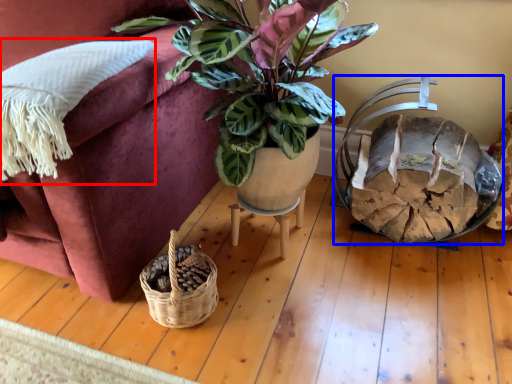
Question: Among these objects, which one is nearest to the camera, pillow (highlighted by a red box) or swivel chair (highlighted by a blue box)?

Choices:
 (A) pillow
 (B) swivel chair

Answer: (A)